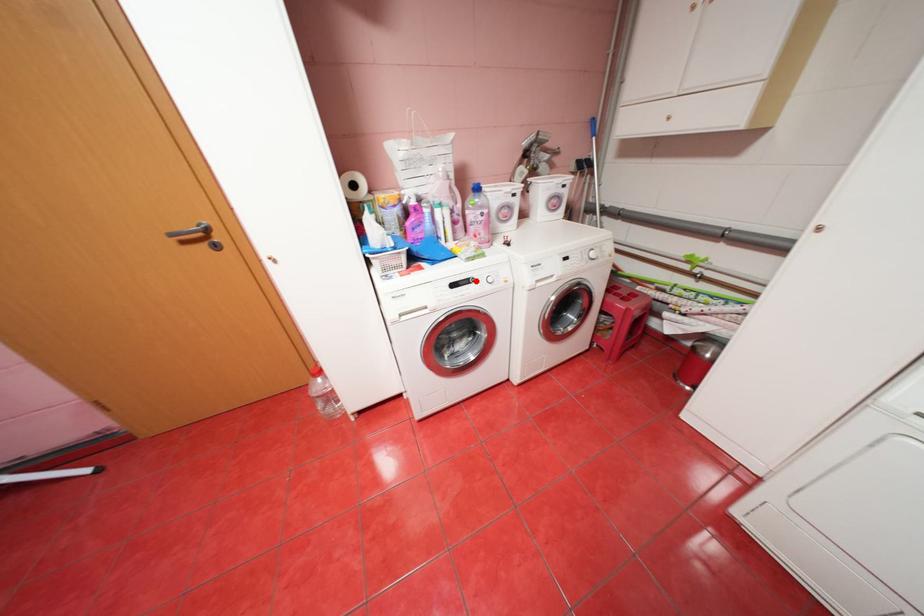
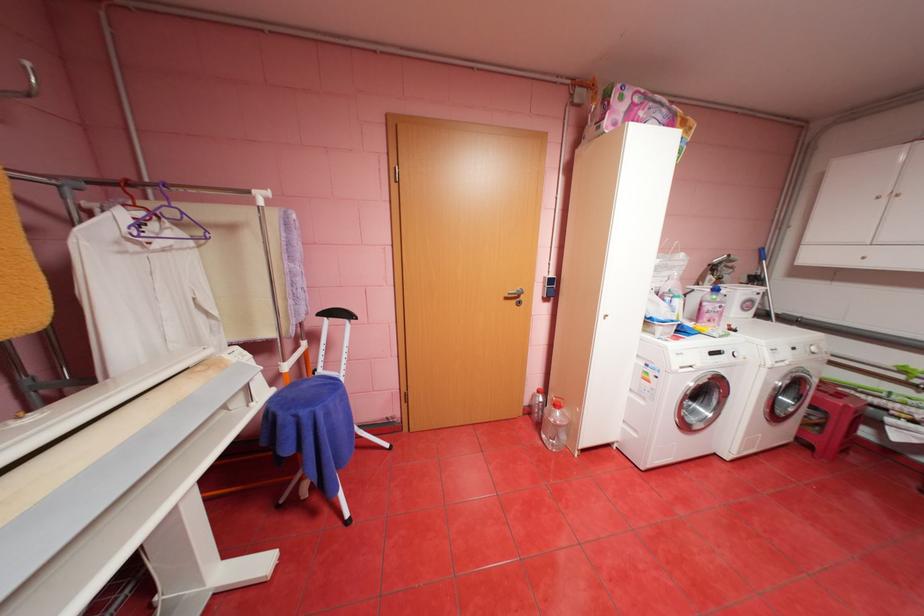
Find the pixel in the second image that matches the highlighted location in the first image.

(728, 352)